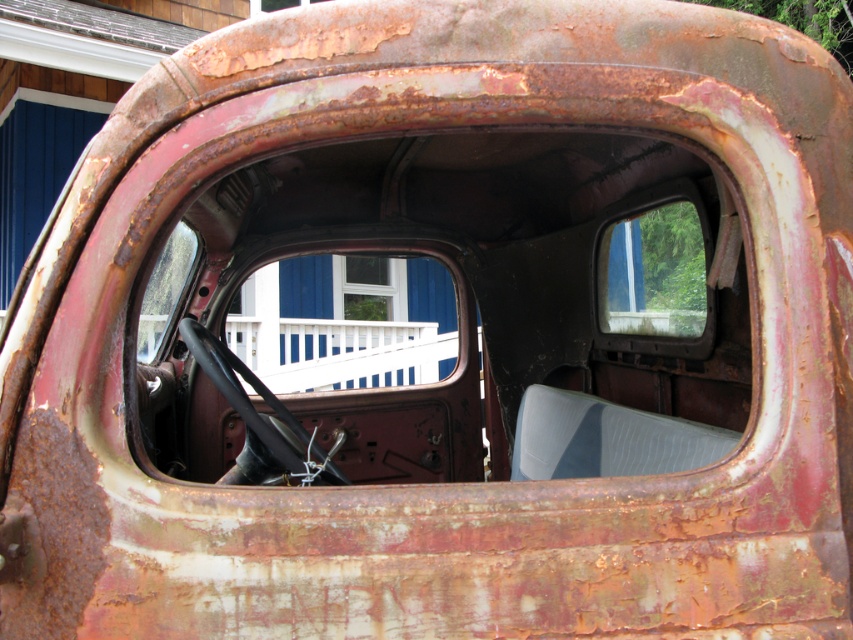
You are standing outside the vehicle looking through the partially open rear window. There is a point marked at coordinates (340, 352). What object is located at that point?

The point at coordinates (340, 352) corresponds to the white painted wood porch at center.

You are standing on the white painted wood porch at center and want to look through the transparent glass window at center to see the view outside. Is the porch wide enough for you to comfortably stand and look through the window?

The white painted wood porch at center might be wider than transparent glass window at center, so it is possible that the porch is wide enough for you to stand and look through the window. However, since the exact width difference isn